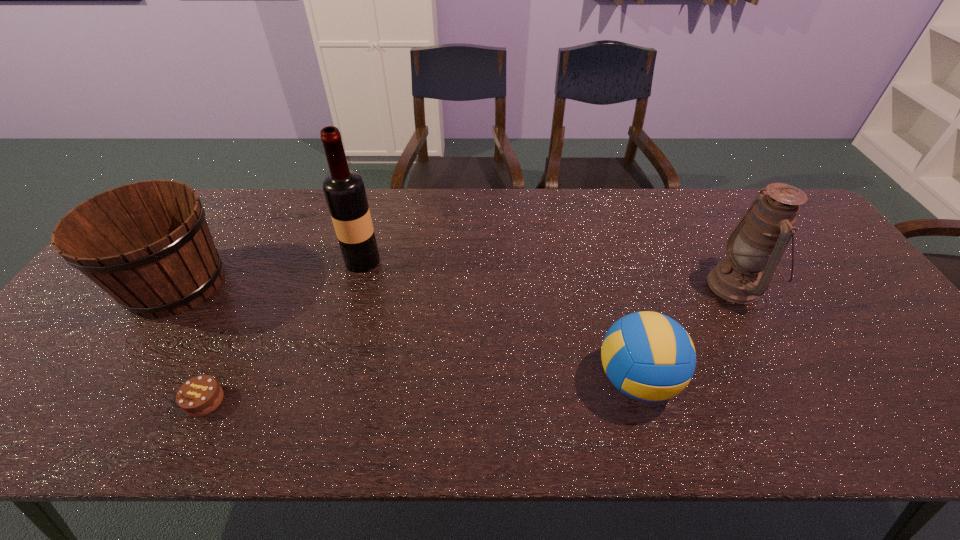
You are a GUI agent. You are given a task and a screenshot of the screen. Output one action in this format:
    pyautogui.click(x=<x>, y=<y>)
    Task: Click on the wine bottle
    
    Given the screenshot: What is the action you would take?
    pyautogui.click(x=344, y=190)

This screenshot has width=960, height=540. I want to click on the tallest object, so click(x=344, y=190).

Where is `the rightmost object`? This screenshot has height=540, width=960. the rightmost object is located at coordinates (760, 239).

Where is `oil lamp`? The image size is (960, 540). oil lamp is located at coordinates (760, 239).

I want to click on the third shortest object, so click(x=148, y=245).

You are a GUI agent. You are given a task and a screenshot of the screen. Output one action in this format:
    pyautogui.click(x=<x>, y=<y>)
    Task: Click on the wine bucket
    
    Given the screenshot: What is the action you would take?
    pyautogui.click(x=148, y=245)

The image size is (960, 540). Find the location of `the fourth object from left to right`. the fourth object from left to right is located at coordinates (648, 356).

Where is `volleyball`? The height and width of the screenshot is (540, 960). volleyball is located at coordinates (648, 356).

At what (x,y) coordinates should I click in order to perform the action: click on chocolate cake. Please return your answer as a coordinate pair (x, y). The height and width of the screenshot is (540, 960). Looking at the image, I should click on (201, 395).

Where is `the second object from left to right`? This screenshot has height=540, width=960. the second object from left to right is located at coordinates (201, 395).